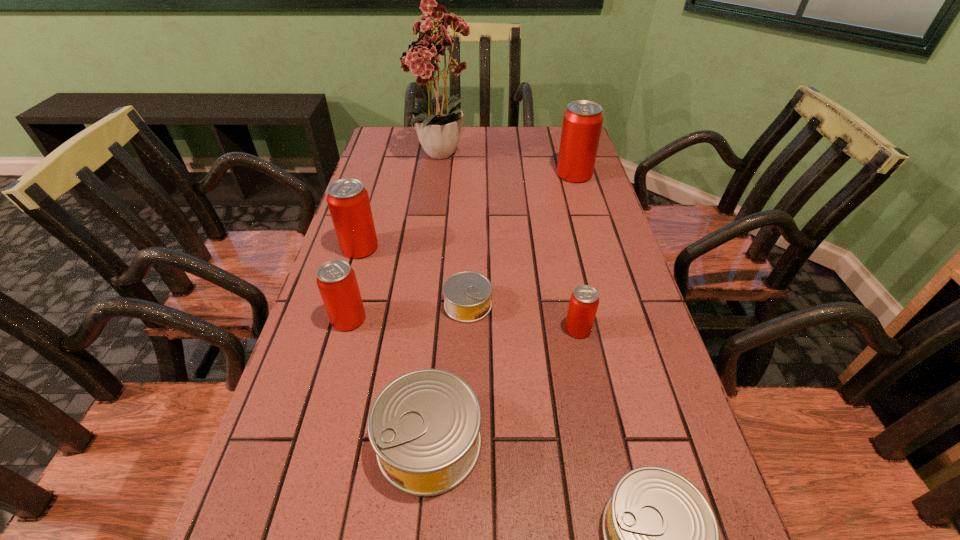
Identify the location of flower arrangement. Image resolution: width=960 pixels, height=540 pixels. (439, 127).

What are the coordinates of `pink flower arrangement` in the screenshot? It's located at (439, 127).

You are a GUI agent. You are given a task and a screenshot of the screen. Output one action in this format:
    pyautogui.click(x=<x>, y=<y>)
    Task: Click on the biggest red can
    
    Given the screenshot: What is the action you would take?
    pyautogui.click(x=582, y=123)

What are the coordinates of `the farthest red can` in the screenshot? It's located at (582, 123).

Find the location of `the second tallest can`. the second tallest can is located at coordinates (348, 201).

I want to click on the second farthest can, so click(x=348, y=201).

Locate an element on the screen. the fourth tallest object is located at coordinates (336, 280).

Identify the location of the second smallest red can. (336, 280).

Where is `the third red can from left to right`? the third red can from left to right is located at coordinates (584, 300).

The height and width of the screenshot is (540, 960). Find the location of `the biggest silver can`. the biggest silver can is located at coordinates point(424,426).